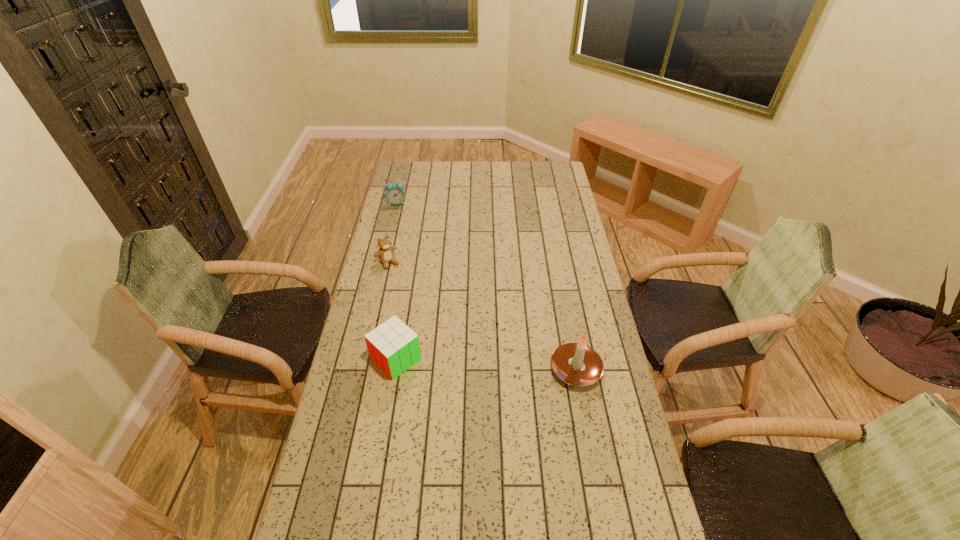
I want to click on vacant space located on the face of the farthest object, so pyautogui.click(x=404, y=218).

Image resolution: width=960 pixels, height=540 pixels. Find the location of `vacant region located on the face of the farthest object`. vacant region located on the face of the farthest object is located at coordinates (402, 212).

The image size is (960, 540). In order to click on vacant area situated on the face of the farthest object in this screenshot , I will do `click(409, 230)`.

What are the coordinates of `cube at the left edge` in the screenshot? It's located at (393, 346).

In order to click on teddy bear situated at the left edge in this screenshot , I will do `click(385, 253)`.

You are a GUI agent. You are given a task and a screenshot of the screen. Output one action in this format:
    pyautogui.click(x=<x>, y=<y>)
    Task: Click on the alarm clock at the left edge
    
    Given the screenshot: What is the action you would take?
    pyautogui.click(x=395, y=194)

Identify the location of object situated at the right edge. (576, 364).

I want to click on free space at the far edge of the desktop, so click(x=481, y=174).

Where is `free space at the near edge of the desktop`? This screenshot has width=960, height=540. free space at the near edge of the desktop is located at coordinates pyautogui.click(x=590, y=508).

This screenshot has width=960, height=540. Find the location of `free space at the left edge of the desktop`. free space at the left edge of the desktop is located at coordinates (356, 348).